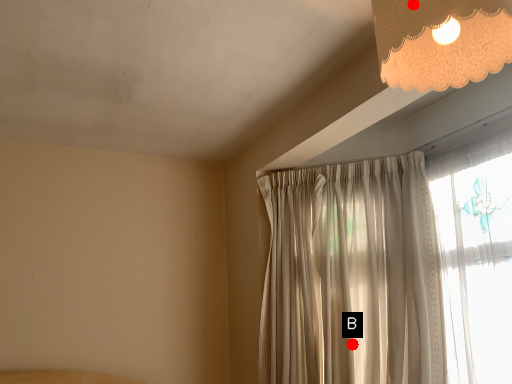
Question: Two points are circled on the image, labeled by A and B beside each circle. Which point is further to the camera?

Choices:
 (A) A is further
 (B) B is further

Answer: (B)